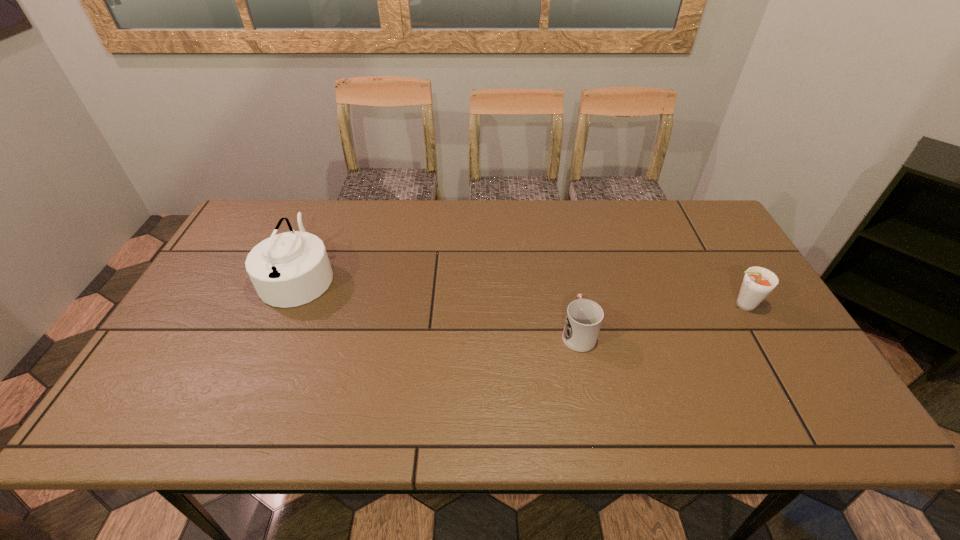
Where is `vacant space at the near right corner of the desktop`? Image resolution: width=960 pixels, height=540 pixels. vacant space at the near right corner of the desktop is located at coordinates (811, 402).

Where is `vacant space in between the root beer and the kettle`? The image size is (960, 540). vacant space in between the root beer and the kettle is located at coordinates (520, 290).

I want to click on empty location between the kettle and the second tallest object, so click(x=520, y=290).

You are a GUI agent. You are given a task and a screenshot of the screen. Output one action in this format:
    pyautogui.click(x=<x>, y=<y>)
    Task: Click on the empty space between the shortest object and the second tallest object
    This screenshot has width=960, height=540.
    Given the screenshot: What is the action you would take?
    pyautogui.click(x=660, y=319)

Where is `empty space between the leftmost object and the cup`? empty space between the leftmost object and the cup is located at coordinates (439, 304).

The image size is (960, 540). In order to click on free spot between the second shortest object and the kettle in this screenshot , I will do `click(520, 290)`.

Locate an element on the screen. free space between the second shortest object and the cup is located at coordinates (660, 319).

At what (x,y) coordinates should I click in order to perform the action: click on free spot between the cup and the root beer. Please return your answer as a coordinate pair (x, y). Looking at the image, I should click on (660, 319).

Where is `vacant space in between the kettle and the cup`? The image size is (960, 540). vacant space in between the kettle and the cup is located at coordinates (439, 304).

The height and width of the screenshot is (540, 960). I want to click on free spot between the shortest object and the leftmost object, so 439,304.